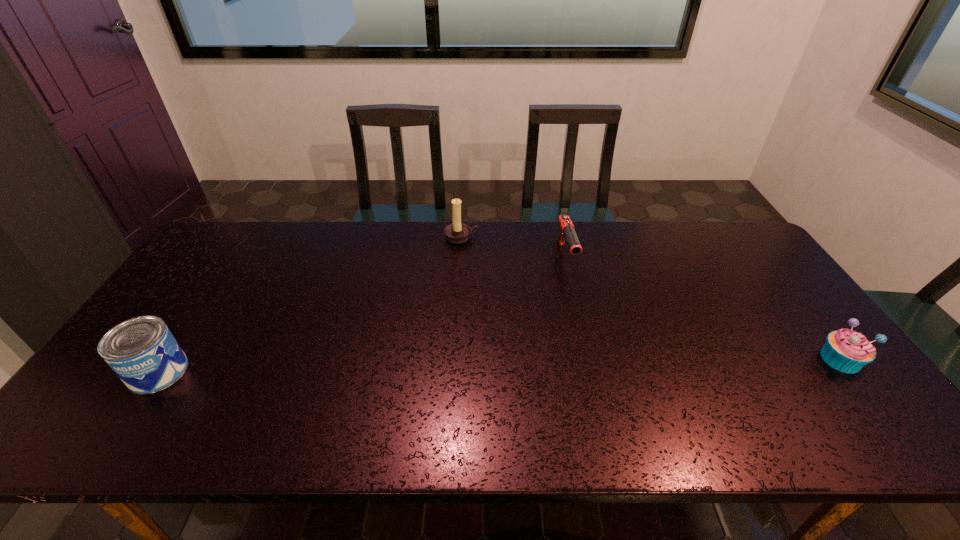
Identify the location of free spot located at the aiming end of the gun. (605, 377).

Where is `vacant space located at the aiming end of the gun`? vacant space located at the aiming end of the gun is located at coordinates (592, 340).

Locate an element on the screen. The width and height of the screenshot is (960, 540). candle holder positioned at the far edge is located at coordinates (457, 232).

The width and height of the screenshot is (960, 540). Identify the location of gun that is at the far edge. (566, 231).

You are a GUI agent. You are given a task and a screenshot of the screen. Output one action in this format:
    pyautogui.click(x=<x>, y=<y>)
    Task: Click on the object present at the near edge
    The width and height of the screenshot is (960, 540).
    Given the screenshot: What is the action you would take?
    pyautogui.click(x=142, y=351)

This screenshot has height=540, width=960. Identify the location of object that is at the left edge. (142, 351).

You are a GUI agent. You are given a task and a screenshot of the screen. Output one action in this format:
    pyautogui.click(x=<x>, y=<y>)
    Task: Click on the object that is positioned at the right edge
    
    Given the screenshot: What is the action you would take?
    pyautogui.click(x=845, y=350)

Identify the location of object that is at the near left corner. (142, 351).

Where is `vacant space at the far edge of the desktop`? The height and width of the screenshot is (540, 960). vacant space at the far edge of the desktop is located at coordinates (499, 224).

Find the location of a particular element. vacant space at the near edge of the desktop is located at coordinates (174, 394).